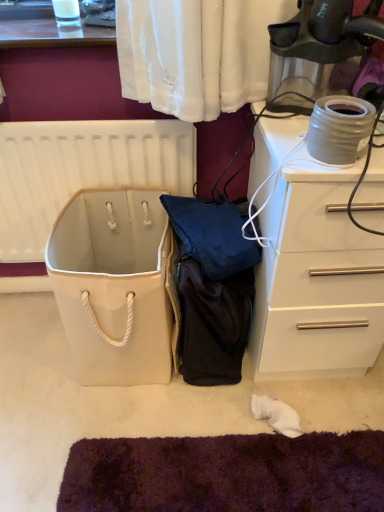
Question: Considering the relative sizes of white glossy chest of drawers at right and matte gray ceramic pot at upper right in the image provided, is white glossy chest of drawers at right bigger than matte gray ceramic pot at upper right?

Choices:
 (A) no
 (B) yes

Answer: (B)

Question: From the image's perspective, is white glossy chest of drawers at right on matte gray ceramic pot at upper right?

Choices:
 (A) no
 (B) yes

Answer: (A)

Question: Is white glossy chest of drawers at right thinner than matte gray ceramic pot at upper right?

Choices:
 (A) no
 (B) yes

Answer: (A)

Question: From a real-world perspective, does white glossy chest of drawers at right stand above matte gray ceramic pot at upper right?

Choices:
 (A) no
 (B) yes

Answer: (A)

Question: Considering the relative sizes of white glossy chest of drawers at right and matte gray ceramic pot at upper right in the image provided, is white glossy chest of drawers at right shorter than matte gray ceramic pot at upper right?

Choices:
 (A) yes
 (B) no

Answer: (B)

Question: Is white glossy chest of drawers at right not close to matte gray ceramic pot at upper right?

Choices:
 (A) no
 (B) yes

Answer: (A)

Question: From a real-world perspective, is white canvas bag at center over white glossy chest of drawers at right?

Choices:
 (A) no
 (B) yes

Answer: (A)

Question: Is white canvas bag at center facing away from white glossy chest of drawers at right?

Choices:
 (A) no
 (B) yes

Answer: (A)

Question: Is white canvas bag at center taller than white glossy chest of drawers at right?

Choices:
 (A) no
 (B) yes

Answer: (A)

Question: Is white canvas bag at center shorter than white glossy chest of drawers at right?

Choices:
 (A) no
 (B) yes

Answer: (B)

Question: Does white canvas bag at center lie behind white glossy chest of drawers at right?

Choices:
 (A) yes
 (B) no

Answer: (A)

Question: Is white canvas bag at center with white glossy chest of drawers at right?

Choices:
 (A) yes
 (B) no

Answer: (B)

Question: Is white canvas bag at center wider than white plastic radiator at upper left?

Choices:
 (A) yes
 (B) no

Answer: (A)